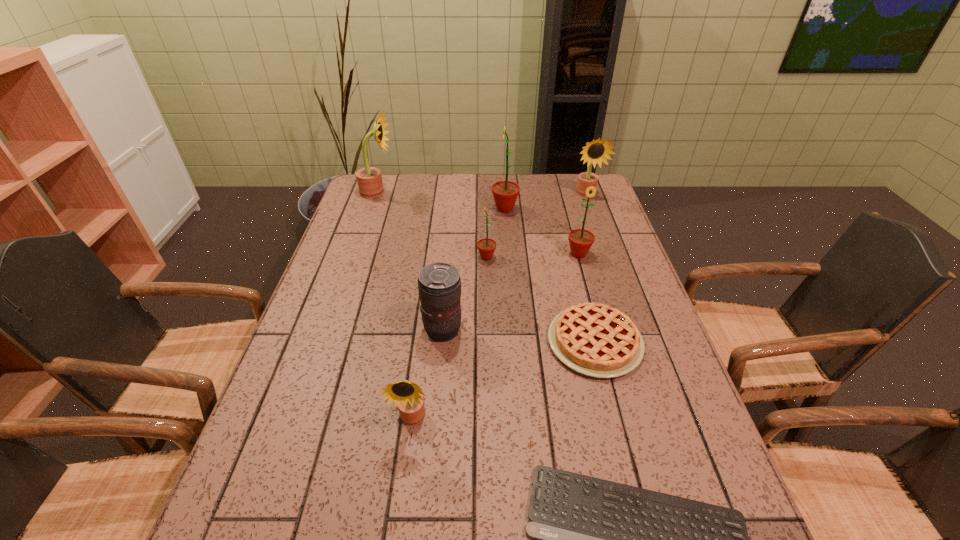
This screenshot has height=540, width=960. In order to click on blank area located 0.210m on the face of the smallest green sunflower in this screenshot , I will do `click(408, 257)`.

Find the location of a particular element. free space located on the face of the nearest sunflower is located at coordinates (404, 481).

Where is `vacant space situated 0.300m on the back of the tan pie`? The height and width of the screenshot is (540, 960). vacant space situated 0.300m on the back of the tan pie is located at coordinates (569, 242).

Where is `object present at the left edge`? The image size is (960, 540). object present at the left edge is located at coordinates (369, 179).

You are a GUI agent. You are given a task and a screenshot of the screen. Output one action in this format:
    pyautogui.click(x=<x>, y=<y>)
    Task: Click on the pie at the right edge
    
    Given the screenshot: What is the action you would take?
    pyautogui.click(x=597, y=340)

The height and width of the screenshot is (540, 960). I want to click on object at the far left corner, so click(x=369, y=179).

Identify the location of object that is at the far right corner. This screenshot has width=960, height=540. (597, 151).

The height and width of the screenshot is (540, 960). In order to click on blank space at the far edge of the desktop in this screenshot , I will do `click(532, 173)`.

The width and height of the screenshot is (960, 540). I want to click on vacant space at the left edge, so click(347, 280).

In the image, there is a desktop. At what (x,y) coordinates should I click in order to perform the action: click on vacant space at the right edge. Please return your answer as a coordinate pair (x, y). The width and height of the screenshot is (960, 540). Looking at the image, I should click on (617, 404).